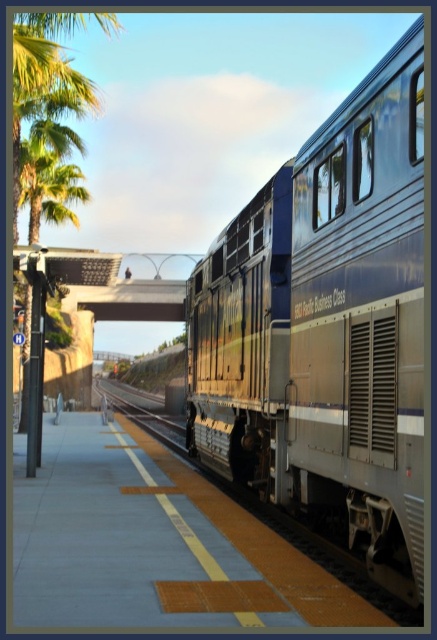
You are a passenger waiting at the train station. You notice the metallic blue train at right and the metal train track at center. Which object is bigger in size?

The metallic blue train at right has a smaller size compared to the metal train track at center, so the metal train track at center is bigger in size.

You are a passenger waiting at the train station and see the metallic blue train at right and the metal train track at center. Which object is located to the right of the other?

The metallic blue train at right is positioned on the right side of metal train track at center.